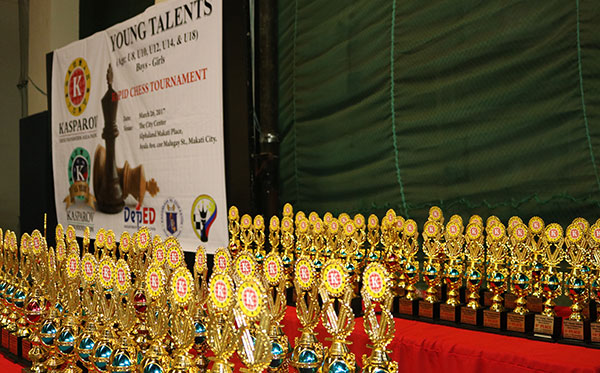
What are the coordinates of `off white wall beam` in the screenshot? It's located at 51,16.